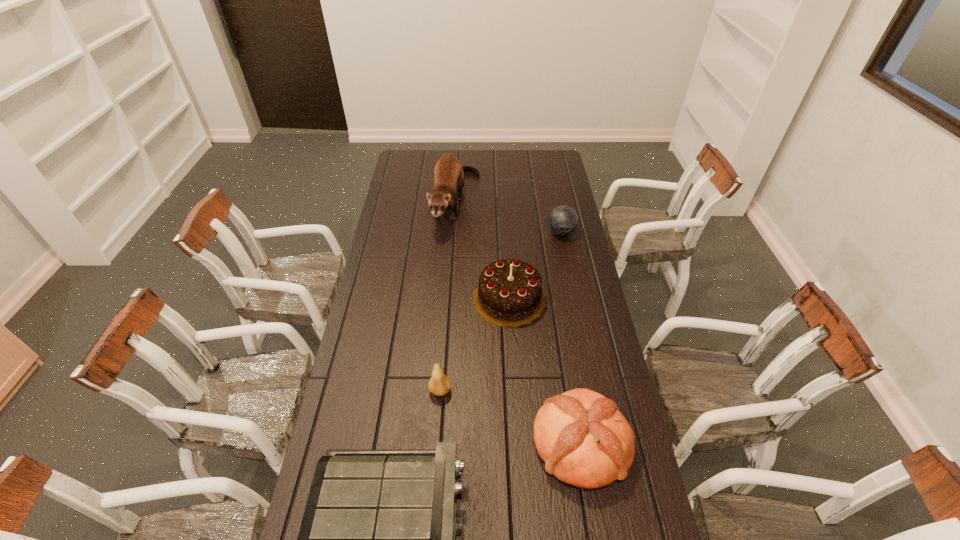
At what (x,y) coordinates should I click in order to perform the action: click on the tallest object. Please return your answer as a coordinate pair (x, y). Looking at the image, I should click on (449, 176).

The image size is (960, 540). Identify the location of the fourth nearest object. (510, 293).

I want to click on the second tallest object, so click(510, 293).

This screenshot has width=960, height=540. Identify the location of bread. (584, 440).

Where is `bowling ball`? The image size is (960, 540). bowling ball is located at coordinates (563, 220).

The image size is (960, 540). I want to click on pear, so click(439, 384).

You are a GUI agent. You are given a task and a screenshot of the screen. Output one action in this format:
    pyautogui.click(x=<x>, y=<y>)
    Task: Click on the free space located at the face of the ferret
    The height and width of the screenshot is (540, 960).
    Given the screenshot: What is the action you would take?
    pyautogui.click(x=452, y=254)

This screenshot has height=540, width=960. Identify the location of vacant space situated on the back of the second tallest object. (505, 225).

Where is `vacant region located 0.120m on the back of the bread`? vacant region located 0.120m on the back of the bread is located at coordinates (568, 368).

The width and height of the screenshot is (960, 540). Identify the location of vacant space situated on the grip area of the bowling ball. (577, 312).